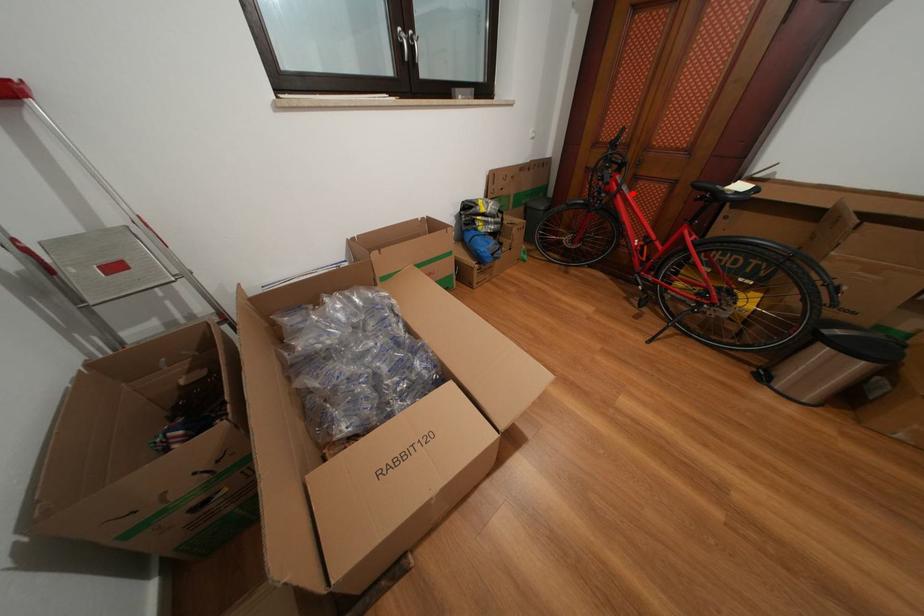
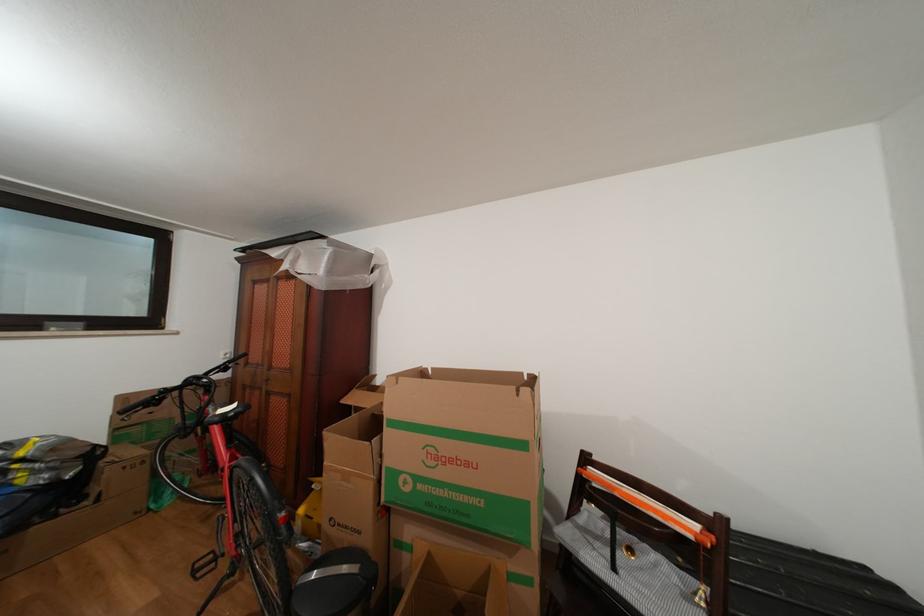
Find the pixel in the second image that matches the highlighted location in the first image.

(219, 414)